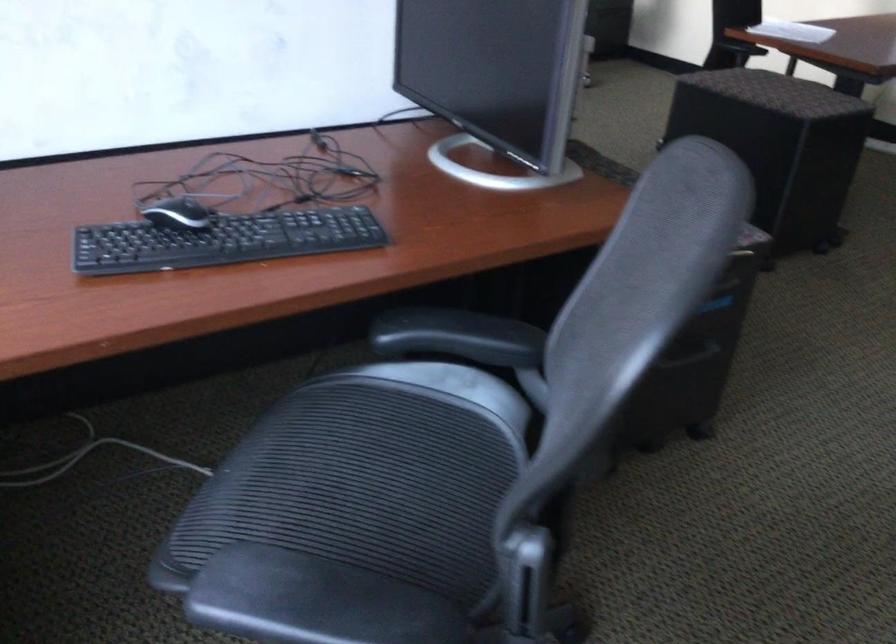
Find where to resting arm the black chair armrest. Please return your answer as a coordinate pair (x, y).

(458, 337)